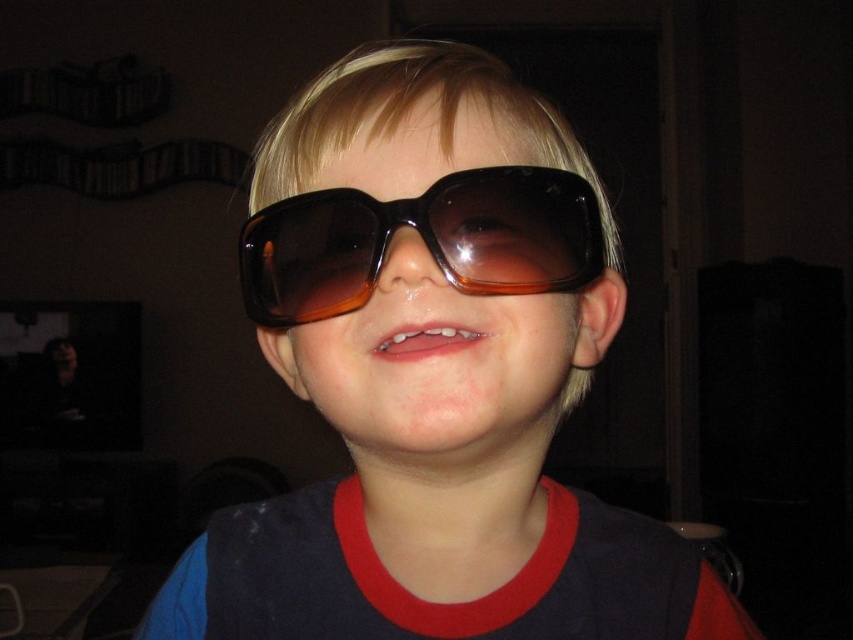
You are a photographer trying to capture a closeup shot of the child in the image. You need to focus on either the brown matte sunglasses at center or the brown translucent plastic goggles at center. Given that your camera has a depth of field that can only clearly focus on objects within 2 inches of each other, will both items be in focus?

The distance between the brown matte sunglasses at center and brown translucent plastic goggles at center is 2.02 inches, which is slightly more than the 2 inches depth of field. Therefore, both items cannot be in focus simultaneously.

You are a photographer adjusting your camera to focus on two points in the image. The first point is at coordinates point (303, 323) and the second is at point (450, 252). Which point should you focus on first if you want to capture the subject closest to the camera?

Point (303, 323) is closer to the camera than point (450, 252), so you should focus on point (303, 323) first to capture the subject closest to the camera.